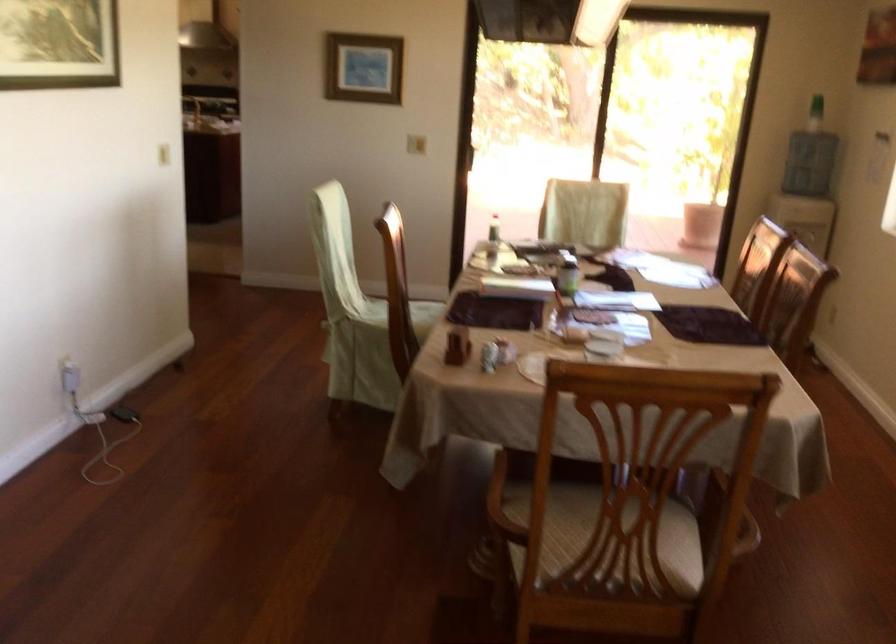
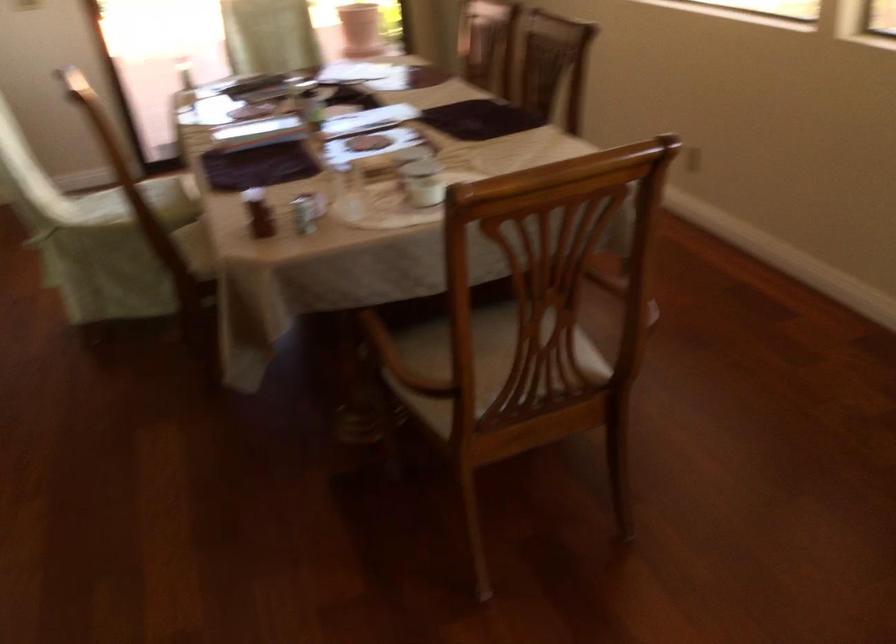
Question: The images are taken continuously from a first-person perspective. In which direction is your viewpoint rotating?

Choices:
 (A) Left
 (B) Right
 (C) Up
 (D) Down

Answer: (B)